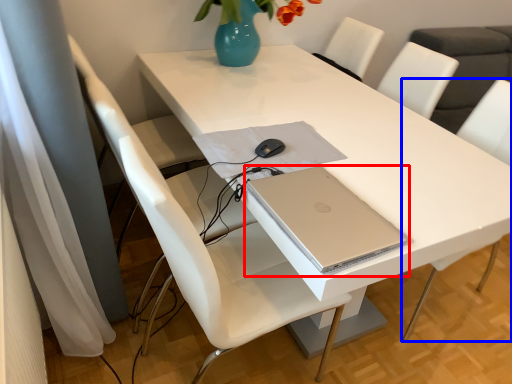
Question: Among these objects, which one is nearest to the camera, computer (highlighted by a red box) or chair (highlighted by a blue box)?

Choices:
 (A) computer
 (B) chair

Answer: (A)